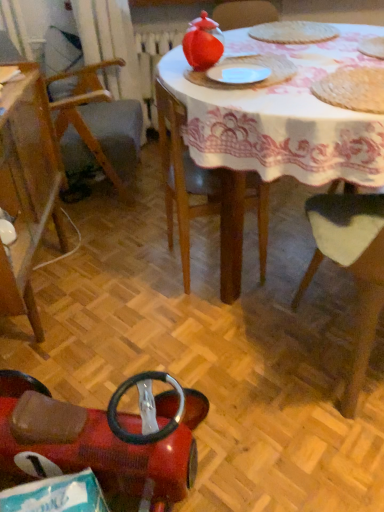
Locate an element on the screen. This screenshot has width=384, height=512. vacant region to the left of woven mat at upper right, the first food when ordered from bottom to top is located at coordinates (274, 96).